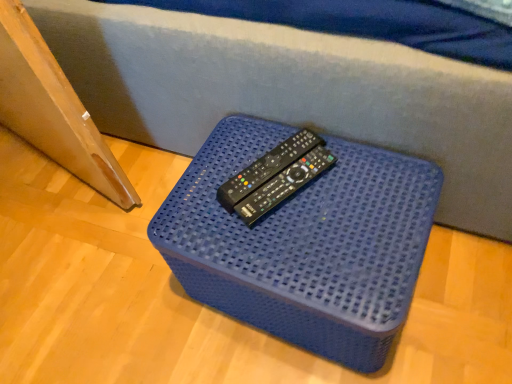
At what (x,y) coordinates should I click in order to perform the action: click on unoccupied region to the right of black plastic remote at center. Please return your answer as a coordinate pair (x, y). This screenshot has width=512, height=384. Looking at the image, I should click on (370, 170).